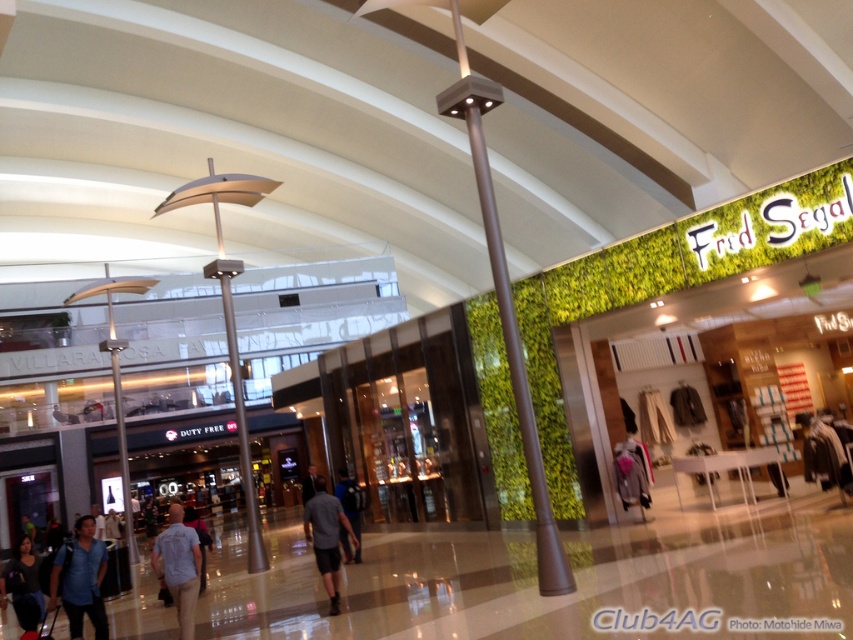
Does light blue shirt at center come behind dark gray fabric bag at lower left?

No, it is in front of dark gray fabric bag at lower left.

Which is more to the left, light blue shirt at center or dark gray fabric bag at lower left?

Positioned to the left is dark gray fabric bag at lower left.

Who is more distant from viewer, (177, 522) or (35, 596)?

Point (35, 596)

At what (x,y) coordinates should I click in order to perform the action: click on light blue shirt at center. Please return your answer as a coordinate pair (x, y). Looking at the image, I should click on (178, 566).

Between dark blue shirt at lower left and gray fabric shorts at center, which one has less height?

dark blue shirt at lower left is shorter.

Can you confirm if dark blue shirt at lower left is shorter than gray fabric shorts at center?

Indeed, dark blue shirt at lower left has a lesser height compared to gray fabric shorts at center.

Where is `dark blue shirt at lower left`? This screenshot has height=640, width=853. dark blue shirt at lower left is located at coordinates (80, 579).

The height and width of the screenshot is (640, 853). In order to click on dark blue shirt at lower left in this screenshot , I will do `click(80, 579)`.

Between point (337, 538) and point (339, 468), which one is positioned behind?

Point (339, 468)

Does point (329, 522) lie behind point (347, 556)?

That is False.

You are a GUI agent. You are given a task and a screenshot of the screen. Output one action in this format:
    pyautogui.click(x=<x>, y=<y>)
    Task: Click on the gray fabric shorts at center
    Image resolution: width=853 pixels, height=640 pixels.
    Given the screenshot: What is the action you would take?
    pyautogui.click(x=326, y=538)